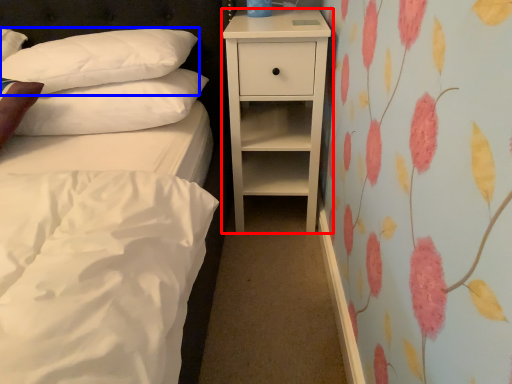
Question: Which point is further to the camera, nightstand (highlighted by a red box) or pillow (highlighted by a blue box)?

Choices:
 (A) nightstand
 (B) pillow

Answer: (A)